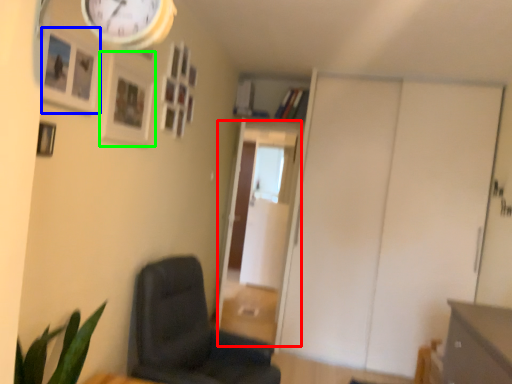
Question: Based on their relative distances, which object is farther from glass door (highlighted by a red box)? Choose from picture frame (highlighted by a blue box) and picture frame (highlighted by a green box).

Choices:
 (A) picture frame
 (B) picture frame

Answer: (A)